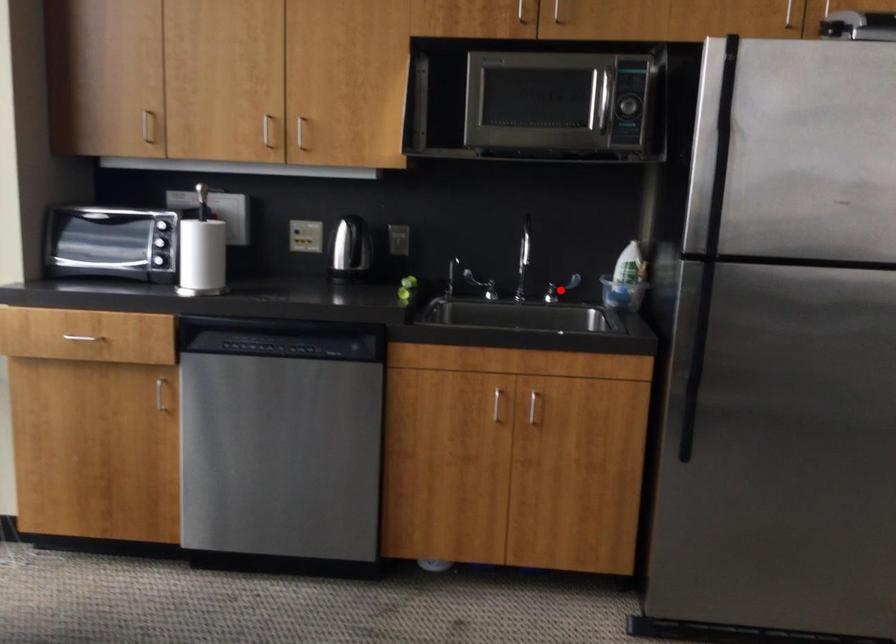
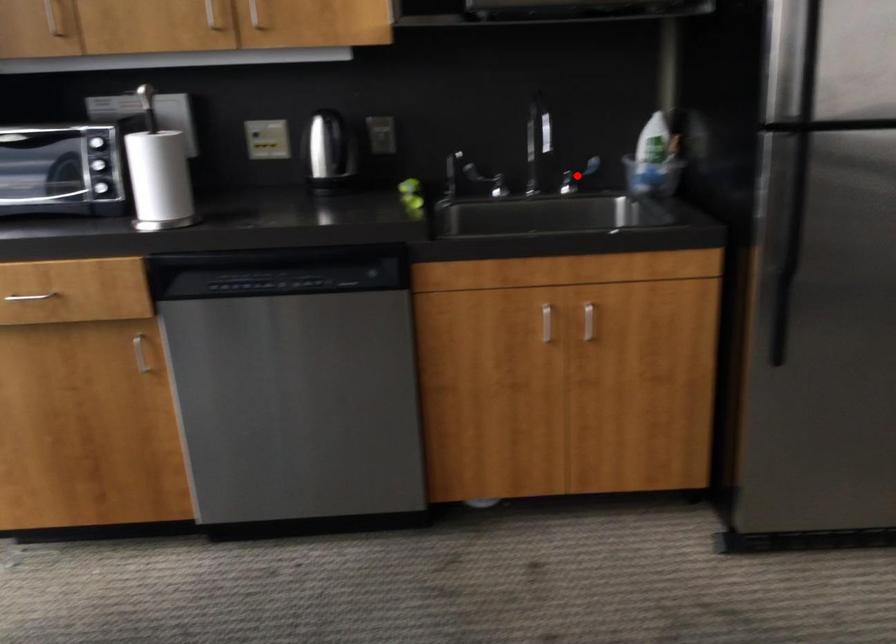
Looking at this image, I am providing you with two images of the same scene from different viewpoints. A red point is marked on the first image and another point is marked on the second image. Is the marked point in image1 the same physical position as the marked point in image2?

Yes